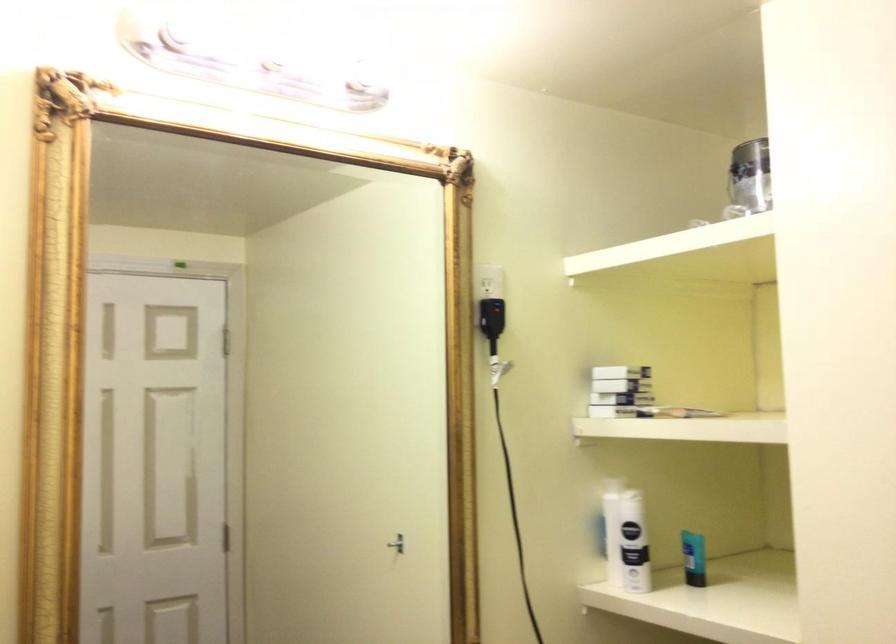
Where would you lift the silver paint can? Please return your answer as a coordinate pair (x, y).

(750, 178)